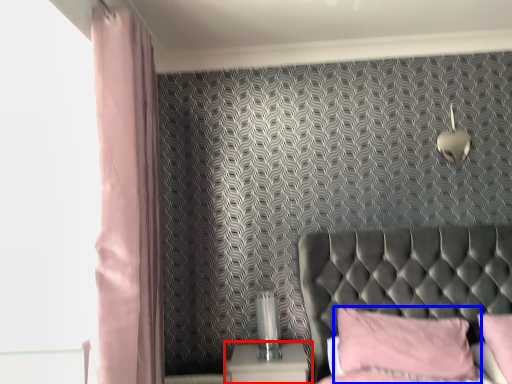
Question: Which of the following is the farthest to the observer, nightstand (highlighted by a red box) or pillow (highlighted by a blue box)?

Choices:
 (A) nightstand
 (B) pillow

Answer: (A)